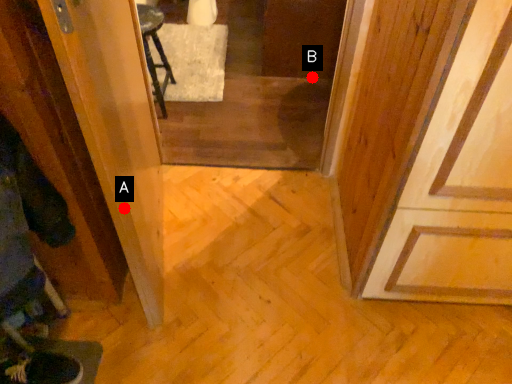
Question: Two points are circled on the image, labeled by A and B beside each circle. Which point is further to the camera?

Choices:
 (A) A is further
 (B) B is further

Answer: (B)